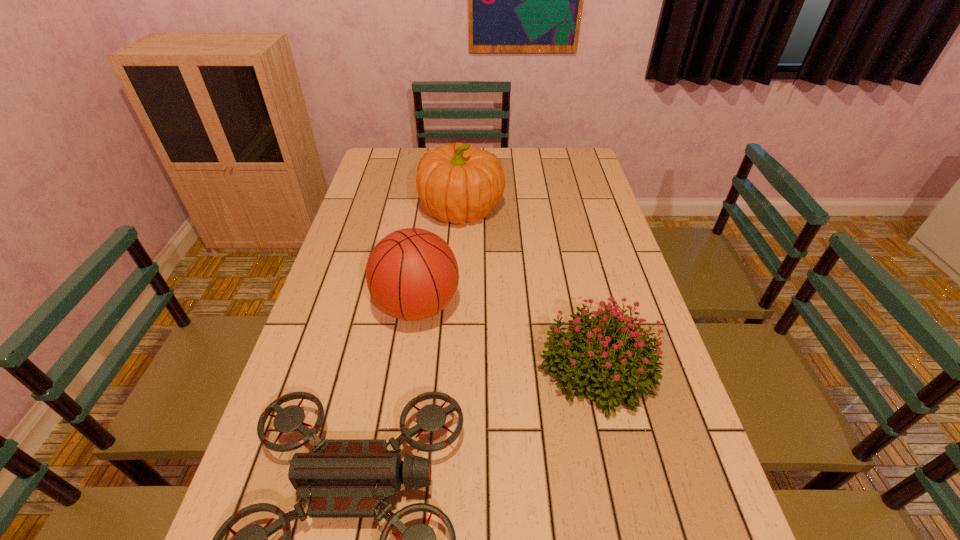
This screenshot has height=540, width=960. I want to click on vacant position in the image that satisfies the following two spatial constraints: 1. on the front side of the bouquet; 2. on the right side of the basketball, so click(409, 368).

The height and width of the screenshot is (540, 960). What are the coordinates of `free point that satisfies the following two spatial constraints: 1. on the surface of the farthest object; 2. on the right side of the bouquet` in the screenshot? It's located at (453, 368).